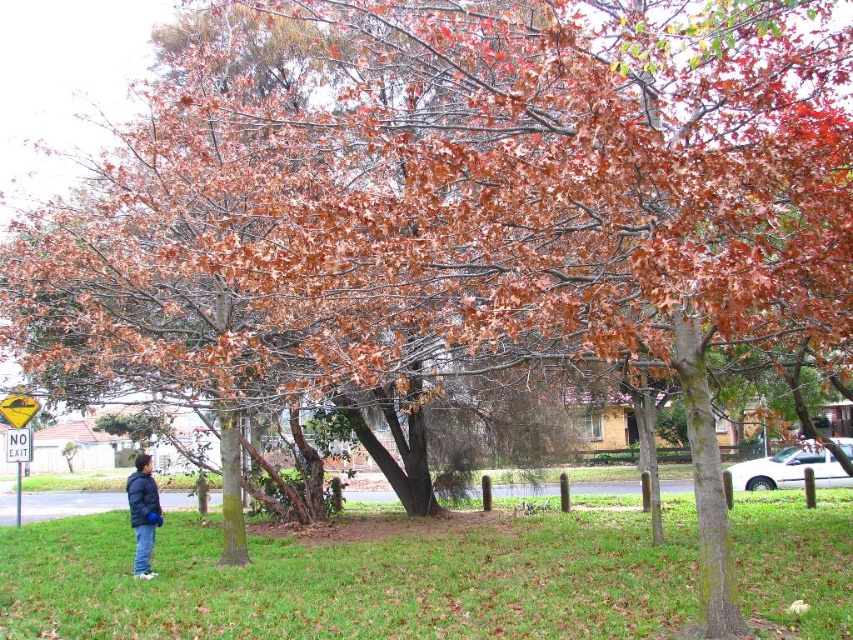
Question: Among these objects, which one is farthest from the camera?

Choices:
 (A) yellowmaterial/texturestreet sign at left
 (B) dark blue jacket at lower left
 (C) yellow plastic traffic sign at upper left

Answer: (C)

Question: Which object appears farthest from the camera in this image?

Choices:
 (A) green grass at lower center
 (B) yellow plastic traffic sign at upper left

Answer: (B)

Question: Does dark blue jacket at lower left lie behind yellow plastic traffic sign at upper left?

Choices:
 (A) yes
 (B) no

Answer: (B)

Question: Among these objects, which one is farthest from the camera?

Choices:
 (A) green grass at lower center
 (B) dark blue jacket at lower left
 (C) yellowmaterial/texturestreet sign at left
 (D) yellow plastic traffic sign at upper left

Answer: (D)

Question: Considering the relative positions of yellowmaterial/texturestreet sign at left and yellow plastic traffic sign at upper left in the image provided, where is yellowmaterial/texturestreet sign at left located with respect to yellow plastic traffic sign at upper left?

Choices:
 (A) below
 (B) above

Answer: (A)

Question: Does green grass at lower center have a greater width compared to dark blue jacket at lower left?

Choices:
 (A) yes
 (B) no

Answer: (A)